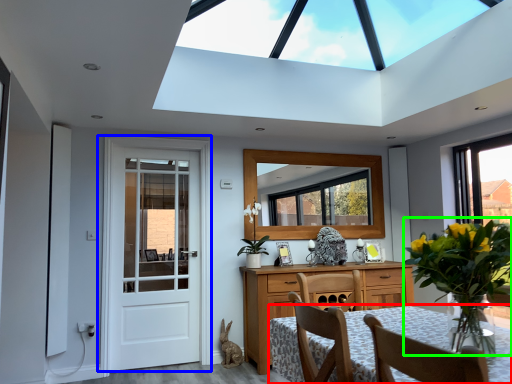
Question: Which is nearer to the table (highlighted by a red box)? door (highlighted by a blue box) or floral arrangement (highlighted by a green box).

Choices:
 (A) door
 (B) floral arrangement

Answer: (B)